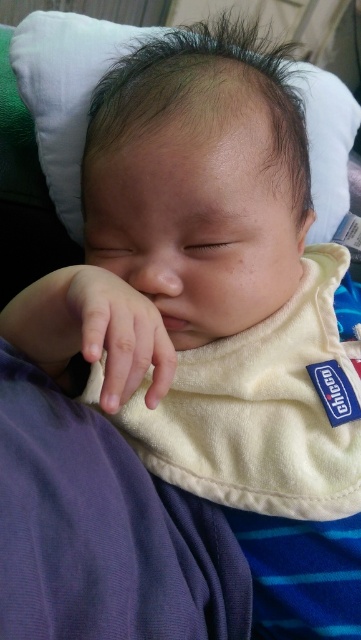
You are a pediatrician examining a newborn. You notice the white soft pillow at upper center and the smooth skin hand at center. Which object is bigger in size?

The white soft pillow at upper center is larger in size than the smooth skin hand at center.

You are a photographer taking a close up of a sleeping baby. You notice a point at coordinates (66, 92). What object is located at that point?

The point at coordinates (66, 92) corresponds to the white soft pillow at upper center.